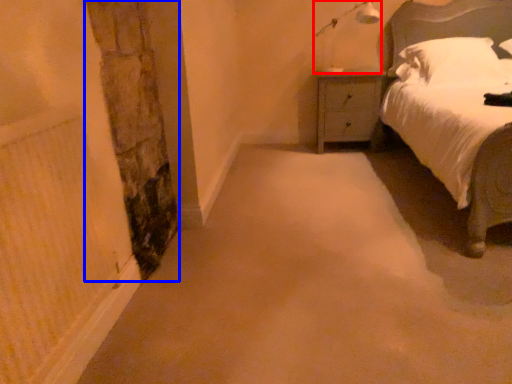
Question: Which object is further to the camera taking this photo, light fixture (highlighted by a red box) or pillar (highlighted by a blue box)?

Choices:
 (A) light fixture
 (B) pillar

Answer: (A)